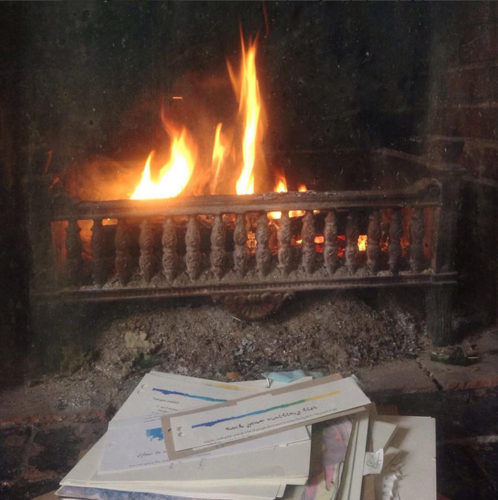
Identify the location of hearth. (446, 377), (57, 397).